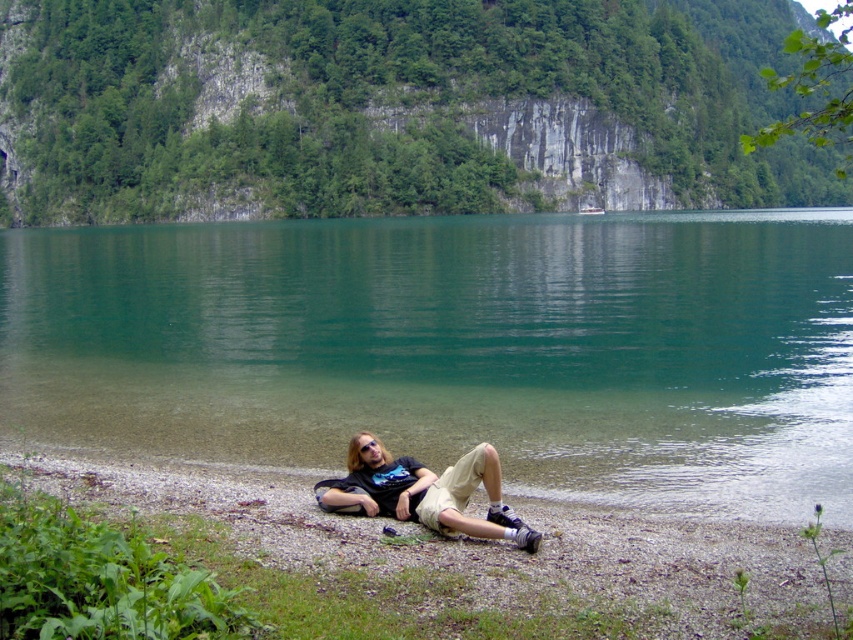
Question: Can you confirm if smooth gravel shoreline at lower center is positioned to the left of matte black t-shirt at lower center?

Choices:
 (A) yes
 (B) no

Answer: (A)

Question: Observing the image, what is the correct spatial positioning of smooth gravel shoreline at lower center in reference to matte black t-shirt at lower center?

Choices:
 (A) above
 (B) below

Answer: (B)

Question: Based on their relative distances, which object is nearer to the matte black t-shirt at lower center?

Choices:
 (A) green smooth water at center
 (B) smooth gravel shoreline at lower center

Answer: (B)

Question: Is smooth gravel shoreline at lower center smaller than matte black t-shirt at lower center?

Choices:
 (A) yes
 (B) no

Answer: (B)

Question: Which point is closer to the camera taking this photo?

Choices:
 (A) (x=648, y=268)
 (B) (x=440, y=522)

Answer: (B)

Question: Which is nearer to the smooth gravel shoreline at lower center?

Choices:
 (A) matte black t-shirt at lower center
 (B) green smooth water at center

Answer: (A)